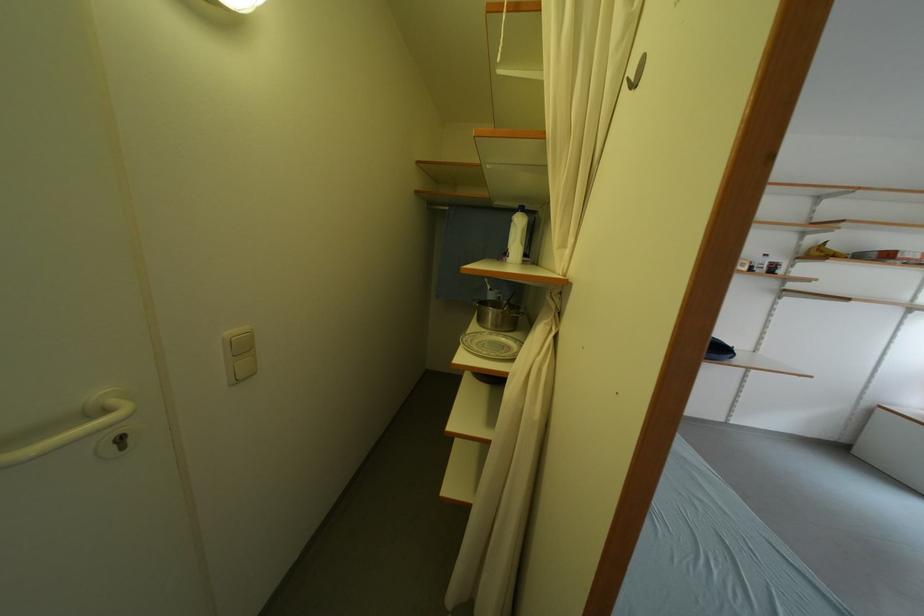
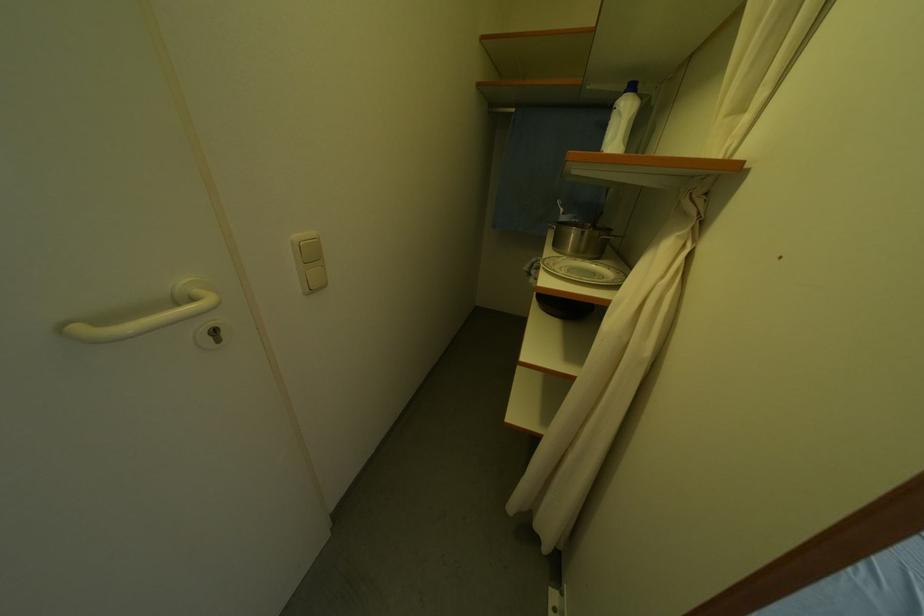
Question: I am providing you with two images of the same scene from different viewpoints. After the viewpoint changes to image2, which objects are now occluded?

Choices:
 (A) white plastic bottle
 (B) door keyhole
 (C) metal cooking pot
 (D) none of these

Answer: (D)